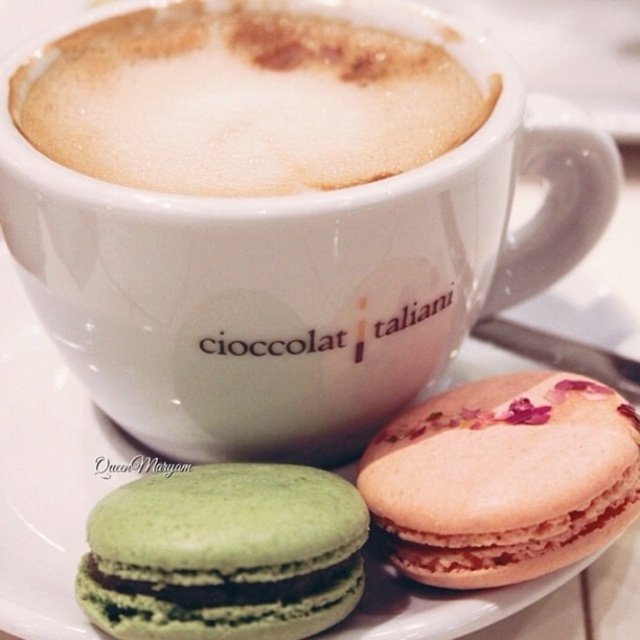
Which is above, foamy white coffee at upper center or pink textured macaron at center?

foamy white coffee at upper center is higher up.

Does foamy white coffee at upper center have a larger size compared to pink textured macaron at center?

Indeed, foamy white coffee at upper center has a larger size compared to pink textured macaron at center.

Who is more forward, (x=115, y=140) or (x=609, y=531)?

Positioned in front is point (x=609, y=531).

You are a GUI agent. You are given a task and a screenshot of the screen. Output one action in this format:
    pyautogui.click(x=<x>, y=<y>)
    Task: Click on the foamy white coffee at upper center
    The width and height of the screenshot is (640, 640).
    Given the screenshot: What is the action you would take?
    pyautogui.click(x=243, y=100)

Can you confirm if foamy white coffee at upper center is positioned above green matte macaron at lower left?

Correct, foamy white coffee at upper center is located above green matte macaron at lower left.

Who is positioned more to the left, foamy white coffee at upper center or green matte macaron at lower left?

Positioned to the left is green matte macaron at lower left.

At what (x,y) coordinates should I click in order to perform the action: click on foamy white coffee at upper center. Please return your answer as a coordinate pair (x, y). Image resolution: width=640 pixels, height=640 pixels. Looking at the image, I should click on (243, 100).

What are the coordinates of `foamy white coffee at upper center` in the screenshot? It's located at (243, 100).

Is pink textured macaron at center wider than green matte macaron at lower left?

No.

Does pink textured macaron at center come behind green matte macaron at lower left?

That is True.

Is point (541, 477) positioned in front of point (305, 589)?

No.

Find the location of a particular element. The width and height of the screenshot is (640, 640). pink textured macaron at center is located at coordinates (504, 477).